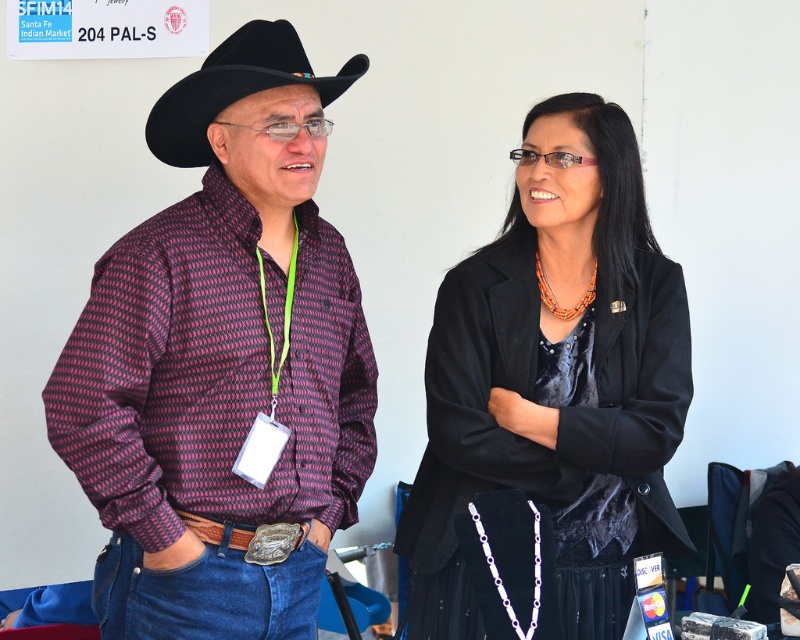
Question: Which object is closer to the camera taking this photo?

Choices:
 (A) black felt cowboy hat at upper left
 (B) plaid shirt at center

Answer: (B)

Question: Where is plaid shirt at center located in relation to black velvet skirt at center in the image?

Choices:
 (A) above
 (B) below

Answer: (A)

Question: Which point is farther to the camera?

Choices:
 (A) (158, 448)
 (B) (632, 234)

Answer: (B)

Question: Is plaid shirt at center to the right of black felt cowboy hat at upper left from the viewer's perspective?

Choices:
 (A) no
 (B) yes

Answer: (A)

Question: Is plaid shirt at center positioned behind black felt cowboy hat at upper left?

Choices:
 (A) yes
 (B) no

Answer: (B)

Question: Which point appears farthest from the camera in this image?

Choices:
 (A) (248, 394)
 (B) (208, 113)
 (C) (433, 598)

Answer: (C)